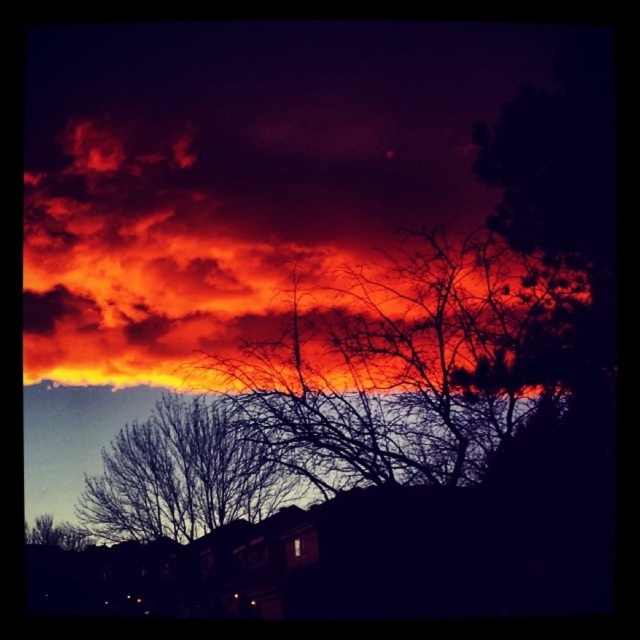
You are an astronomer analyzing the sunset image. You notice a point labeled at coordinates (208, 244). What does this point indicate in the scene?

The point at coordinates (208, 244) marks the fiery orange cloud at upper center in the scene.

You are an artist trying to paint the sunset scene. You need to decide the vertical positioning of the fiery orange cloud at upper center and the silhouette bare tree at lower left. Based on the scene, which object should be placed higher in your painting?

The fiery orange cloud at upper center should be placed higher in the painting because it is taller than the silhouette bare tree at lower left.

You are an astronomer analyzing the sunset scene. You need to locate the fiery orange cloud at upper center. What are its coordinates?

The fiery orange cloud at upper center is located at coordinates point (208, 244).